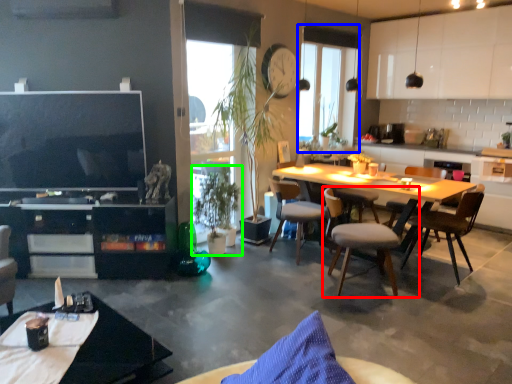
Question: Which object is the closest to the chair (highlighted by a red box)? Choose among these: window screen (highlighted by a blue box) or houseplant (highlighted by a green box).

Choices:
 (A) window screen
 (B) houseplant

Answer: (B)